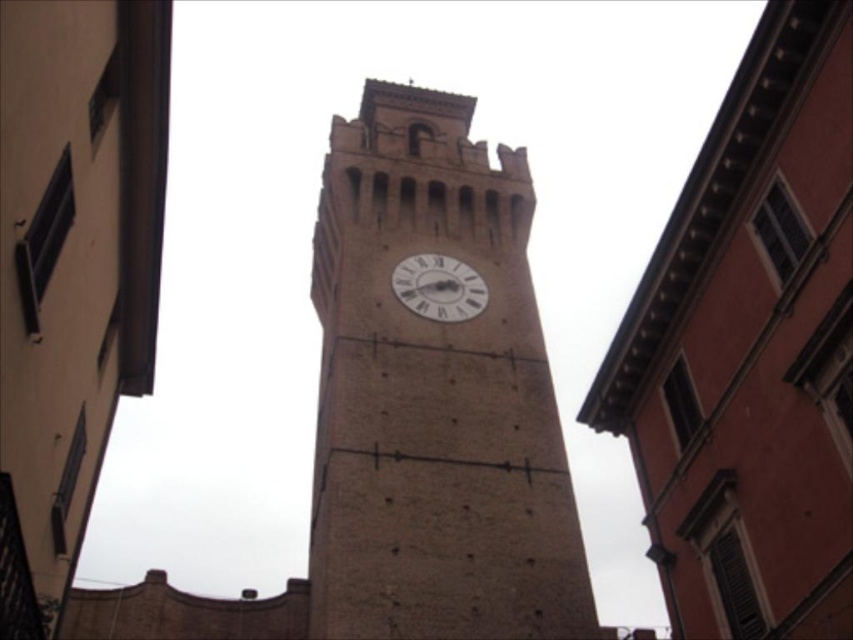
Does brown stone clock tower at center have a lesser height compared to white matte clock at center?

No, brown stone clock tower at center is not shorter than white matte clock at center.

Who is more forward, (485,381) or (469,268)?

Point (485,381)

I want to click on brown stone clock tower at center, so click(x=434, y=394).